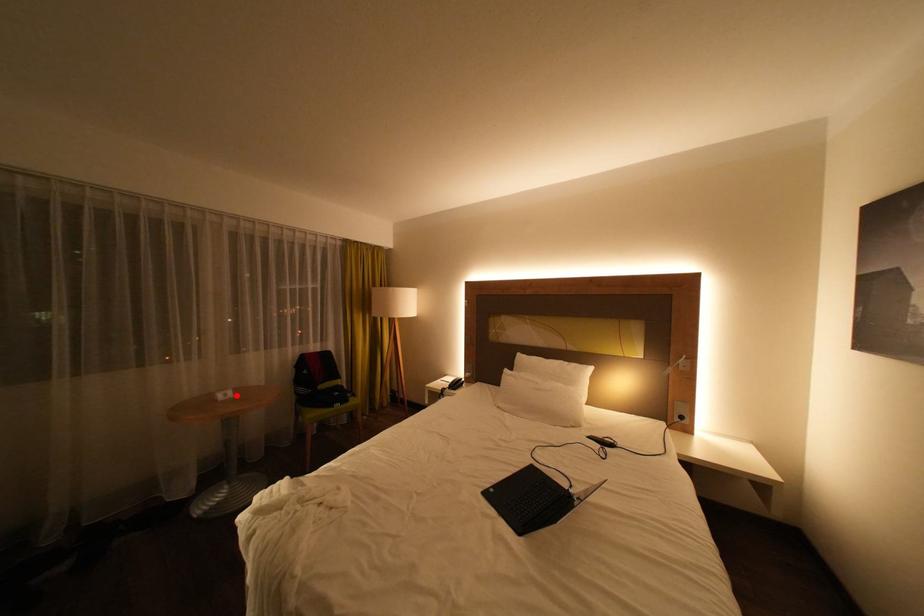
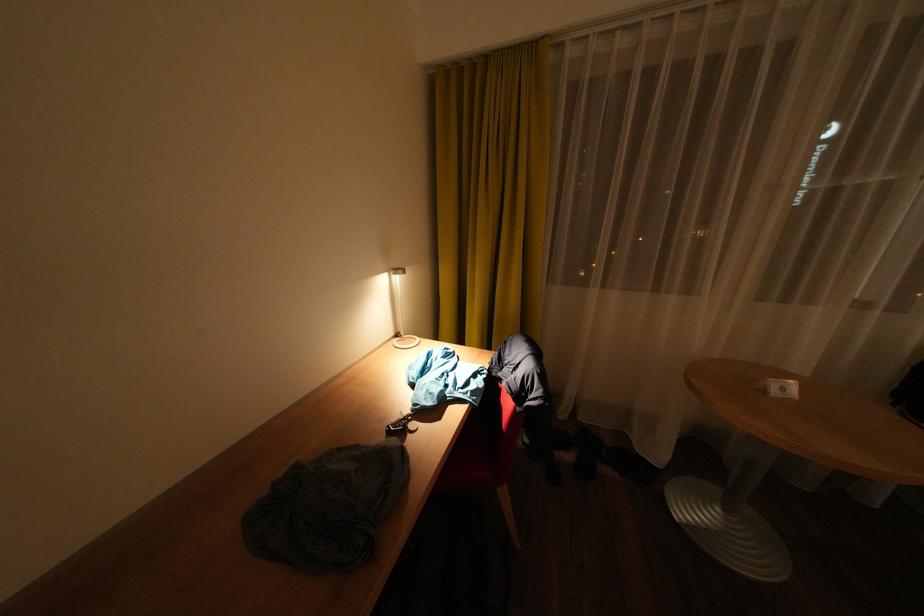
Question: I am providing you with two images of the same scene from different viewpoints. A red point is marked on the first image. Is the red point's position out of view in image 2?

Choices:
 (A) Yes
 (B) No

Answer: (B)